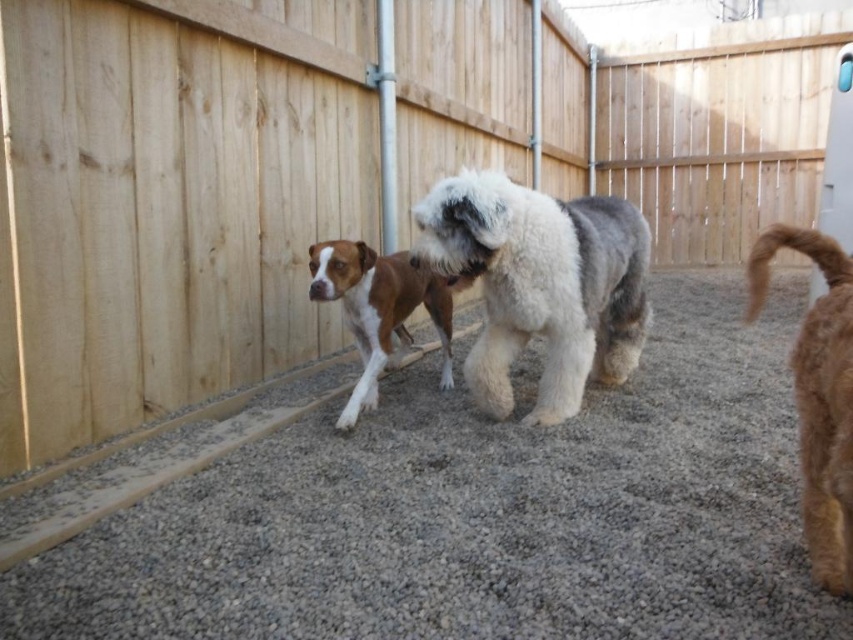
You are a small robot with a width of 0.8 meters. You are positioned in the backyard and need to move from the white fluffy dog at center to the brown furry tail at right. Is there enough space for you to navigate between them without touching either?

The distance between the white fluffy dog at center and the brown furry tail at right is 1.00 meters. Since the robot is 0.8 meters wide, there is sufficient space to navigate between them without touching either.

You are planning to build a fence gate that needs to accommodate the largest dog in the scene. Based on the white fluffy dog at center and the brown furry tail at right, which dog requires a wider gate opening?

The white fluffy dog at center requires a wider gate opening because it has a larger size compared to the brown furry tail at right.